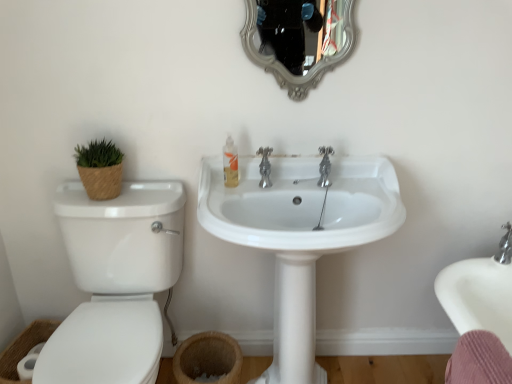
Question: Is white glossy toilet at left at the right side of silver/gilded mirror at upper center?

Choices:
 (A) no
 (B) yes

Answer: (A)

Question: Is white glossy toilet at left surrounding silver/gilded mirror at upper center?

Choices:
 (A) yes
 (B) no

Answer: (B)

Question: From the image's perspective, does white glossy toilet at left appear lower than silver/gilded mirror at upper center?

Choices:
 (A) yes
 (B) no

Answer: (A)

Question: Does white glossy toilet at left have a lesser width compared to silver/gilded mirror at upper center?

Choices:
 (A) yes
 (B) no

Answer: (B)

Question: Is white glossy toilet at left with silver/gilded mirror at upper center?

Choices:
 (A) yes
 (B) no

Answer: (B)

Question: From a real-world perspective, is silver/gilded mirror at upper center physically located above or below white glossy toilet at left?

Choices:
 (A) above
 (B) below

Answer: (A)

Question: In terms of height, does silver/gilded mirror at upper center look taller or shorter compared to white glossy toilet at left?

Choices:
 (A) tall
 (B) short

Answer: (B)

Question: In the image, is silver/gilded mirror at upper center positioned in front of or behind white glossy toilet at left?

Choices:
 (A) behind
 (B) front

Answer: (A)

Question: Is point (284, 11) closer or farther from the camera than point (104, 380)?

Choices:
 (A) farther
 (B) closer

Answer: (A)

Question: Visually, is translucent plastic soap dispenser at center positioned to the left or to the right of chrome metallic faucet at center?

Choices:
 (A) left
 (B) right

Answer: (A)

Question: From a real-world perspective, is translucent plastic soap dispenser at center positioned above or below chrome metallic faucet at center?

Choices:
 (A) below
 (B) above

Answer: (B)

Question: Is translucent plastic soap dispenser at center inside the boundaries of chrome metallic faucet at center, or outside?

Choices:
 (A) inside
 (B) outside

Answer: (B)

Question: Based on their sizes in the image, would you say translucent plastic soap dispenser at center is bigger or smaller than chrome metallic faucet at center?

Choices:
 (A) small
 (B) big

Answer: (A)

Question: From their relative heights in the image, would you say chrome metallic faucet at center is taller or shorter than translucent plastic soap dispenser at center?

Choices:
 (A) tall
 (B) short

Answer: (B)

Question: From the image's perspective, is chrome metallic faucet at center located above or below translucent plastic soap dispenser at center?

Choices:
 (A) above
 (B) below

Answer: (B)